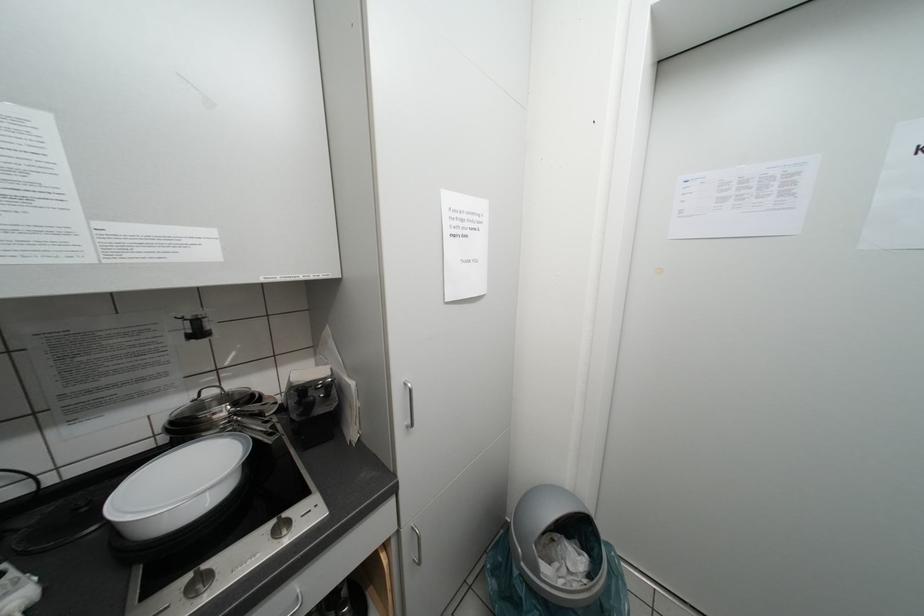
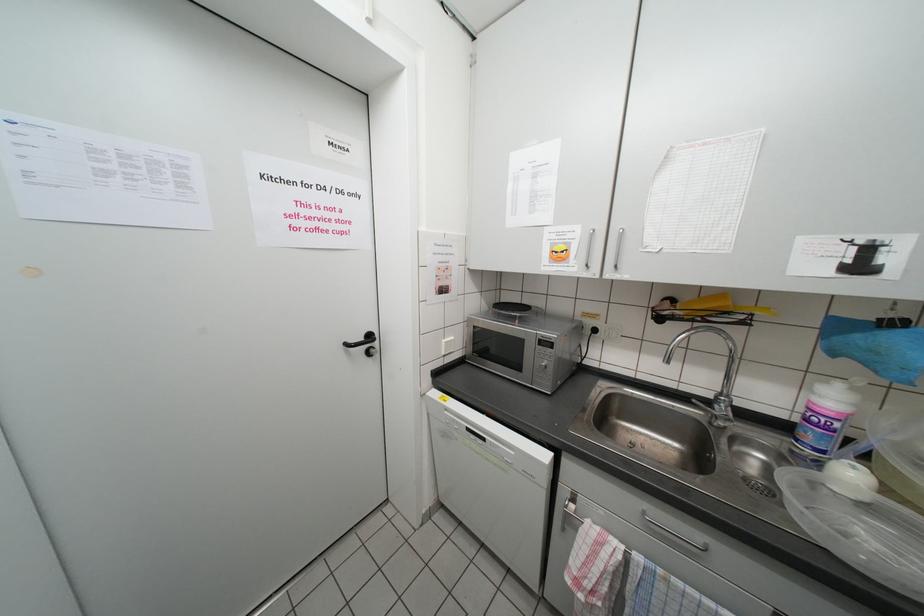
Question: The camera is either moving clockwise (left) or counter-clockwise (right) around the object. The first image is from the beginning of the video and the second image is from the end. Is the camera moving left or right when shooting the video?

Choices:
 (A) Left
 (B) Right

Answer: (A)